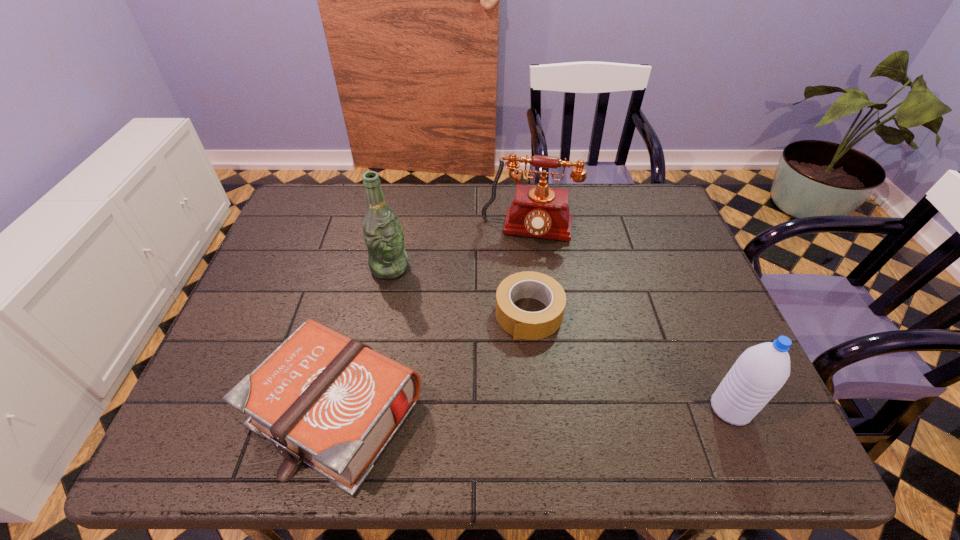
The width and height of the screenshot is (960, 540). I want to click on vacant space situated on the surface of the tallest object, so click(x=428, y=300).

Where is `vacant space located on the surface of the tallest object`? The height and width of the screenshot is (540, 960). vacant space located on the surface of the tallest object is located at coordinates (460, 327).

Locate an element on the screen. This screenshot has height=540, width=960. vacant space located 0.280m on the dial of the farthest object is located at coordinates (510, 327).

You are a GUI agent. You are given a task and a screenshot of the screen. Output one action in this format:
    pyautogui.click(x=<x>, y=<y>)
    Task: Click on the vacant space situated 0.150m on the dial of the farthest object
    
    Given the screenshot: What is the action you would take?
    pyautogui.click(x=516, y=287)

You are a GUI agent. You are given a task and a screenshot of the screen. Output one action in this format:
    pyautogui.click(x=<x>, y=<y>)
    Task: Click on the vacant space located 0.060m on the dial of the farthest object
    
    Given the screenshot: What is the action you would take?
    pyautogui.click(x=520, y=264)

Locate an element on the screen. vacant space located 0.080m at the edge of the shortest object is located at coordinates (506, 366).

This screenshot has width=960, height=540. I want to click on vacant area situated 0.190m at the edge of the shortest object, so click(488, 408).

Where is `object that is at the far edge`? object that is at the far edge is located at coordinates (540, 211).

Locate an element on the screen. Bible that is at the near edge is located at coordinates (323, 399).

Identify the location of water bottle that is positioned at the near edge. The height and width of the screenshot is (540, 960). pos(759,373).